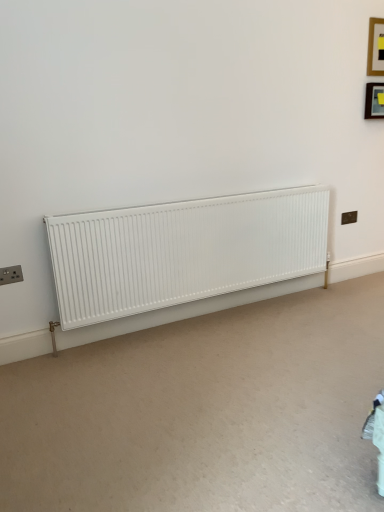
Question: Considering the relative sizes of black plastic electric outlet at upper right, marked as the 1th electric outlet in a back-to-front arrangement, and matte black picture frame at upper right, which is counted as the 2th picture frame, starting from the top, in the image provided, is black plastic electric outlet at upper right, marked as the 1th electric outlet in a back-to-front arrangement, taller than matte black picture frame at upper right, which is counted as the 2th picture frame, starting from the top,?

Choices:
 (A) yes
 (B) no

Answer: (B)

Question: From a real-world perspective, is black plastic electric outlet at upper right, positioned as the first electric outlet in top-to-bottom order, over matte black picture frame at upper right, which is the 1th picture frame in bottom-to-top order?

Choices:
 (A) yes
 (B) no

Answer: (B)

Question: Considering the relative sizes of black plastic electric outlet at upper right, marked as the 1th electric outlet in a back-to-front arrangement, and matte black picture frame at upper right, which is the 1th picture frame in bottom-to-top order, in the image provided, is black plastic electric outlet at upper right, marked as the 1th electric outlet in a back-to-front arrangement, shorter than matte black picture frame at upper right, which is the 1th picture frame in bottom-to-top order,?

Choices:
 (A) no
 (B) yes

Answer: (B)

Question: Is black plastic electric outlet at upper right, positioned as the first electric outlet in top-to-bottom order, outside matte black picture frame at upper right, which is the 1th picture frame in bottom-to-top order?

Choices:
 (A) yes
 (B) no

Answer: (A)

Question: Is black plastic electric outlet at upper right, the 2th electric outlet from the bottom, further to the viewer compared to matte black picture frame at upper right, which is the 1th picture frame in bottom-to-top order?

Choices:
 (A) no
 (B) yes

Answer: (B)

Question: Can you see black plastic electric outlet at upper right, positioned as the first electric outlet in top-to-bottom order, touching matte black picture frame at upper right, which is the 1th picture frame in bottom-to-top order?

Choices:
 (A) yes
 (B) no

Answer: (B)

Question: Does black plastic electric outlet at upper right, positioned as the first electric outlet in top-to-bottom order, have a lesser width compared to matte black socket at lower left, which is the second electric outlet in right-to-left order?

Choices:
 (A) yes
 (B) no

Answer: (A)

Question: From a real-world perspective, is black plastic electric outlet at upper right, the 2th electric outlet in the front-to-back sequence, below matte black socket at lower left, which is counted as the 2th electric outlet, starting from the back?

Choices:
 (A) yes
 (B) no

Answer: (A)

Question: Considering the relative sizes of black plastic electric outlet at upper right, which is counted as the first electric outlet, starting from the right, and matte black socket at lower left, which is the second electric outlet in top-to-bottom order, in the image provided, is black plastic electric outlet at upper right, which is counted as the first electric outlet, starting from the right, wider than matte black socket at lower left, which is the second electric outlet in top-to-bottom order,?

Choices:
 (A) yes
 (B) no

Answer: (B)

Question: Is black plastic electric outlet at upper right, marked as the 1th electric outlet in a back-to-front arrangement, outside matte black socket at lower left, which is the first electric outlet from front to back?

Choices:
 (A) no
 (B) yes

Answer: (B)

Question: From the image's perspective, is black plastic electric outlet at upper right, the 2th electric outlet from the bottom, below matte black socket at lower left, which is the first electric outlet from front to back?

Choices:
 (A) no
 (B) yes

Answer: (A)

Question: From a real-world perspective, is black plastic electric outlet at upper right, positioned as the first electric outlet in top-to-bottom order, located higher than matte black socket at lower left, which is counted as the 2th electric outlet, starting from the back?

Choices:
 (A) yes
 (B) no

Answer: (B)

Question: Would you say wooden frame at upper right, acting as the first picture frame starting from the top, contains matte black socket at lower left, arranged as the 1th electric outlet when ordered from the bottom?

Choices:
 (A) no
 (B) yes

Answer: (A)